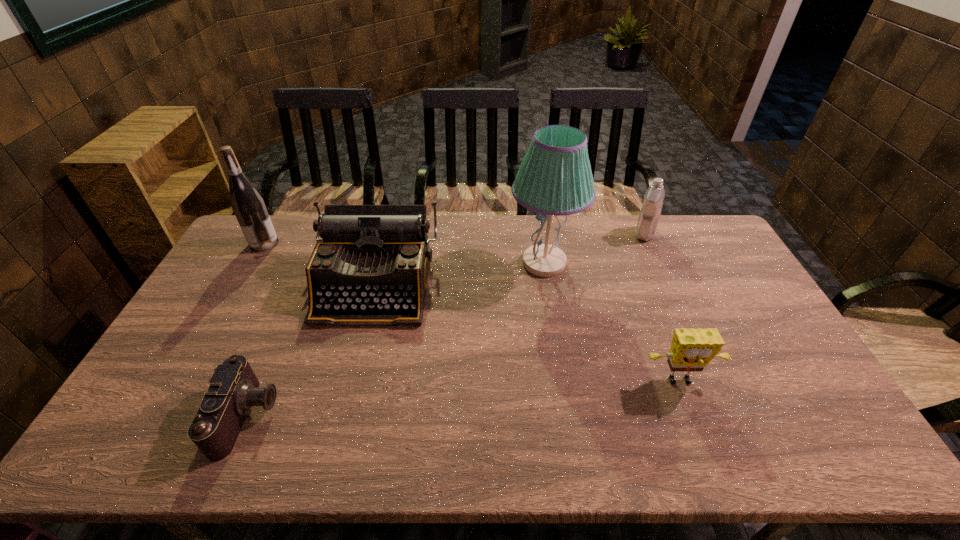
Identify the location of unoccupied position between the shortest object and the detergent. The image size is (960, 540). (446, 325).

The image size is (960, 540). Find the location of `unoccupied position between the third object from right to left and the sponge`. unoccupied position between the third object from right to left and the sponge is located at coordinates (612, 322).

Where is `free space between the fifth tallest object and the tallest object`? This screenshot has height=540, width=960. free space between the fifth tallest object and the tallest object is located at coordinates (612, 322).

Identify the location of vacant space that's between the tallest object and the camera. (396, 340).

What are the coordinates of `free space between the typewriter and the detergent` in the screenshot? It's located at (510, 259).

What are the coordinates of `object that ranks as the fourth closest to the typewriter` in the screenshot? It's located at (691, 349).

In order to click on the second closest object relative to the camera in this screenshot , I will do `click(249, 208)`.

The width and height of the screenshot is (960, 540). Find the location of `free spot that satisfies the following two spatial constraints: 1. on the keyboard of the typewriter; 2. on the front-facing side of the shortest object`. free spot that satisfies the following two spatial constraints: 1. on the keyboard of the typewriter; 2. on the front-facing side of the shortest object is located at coordinates (342, 416).